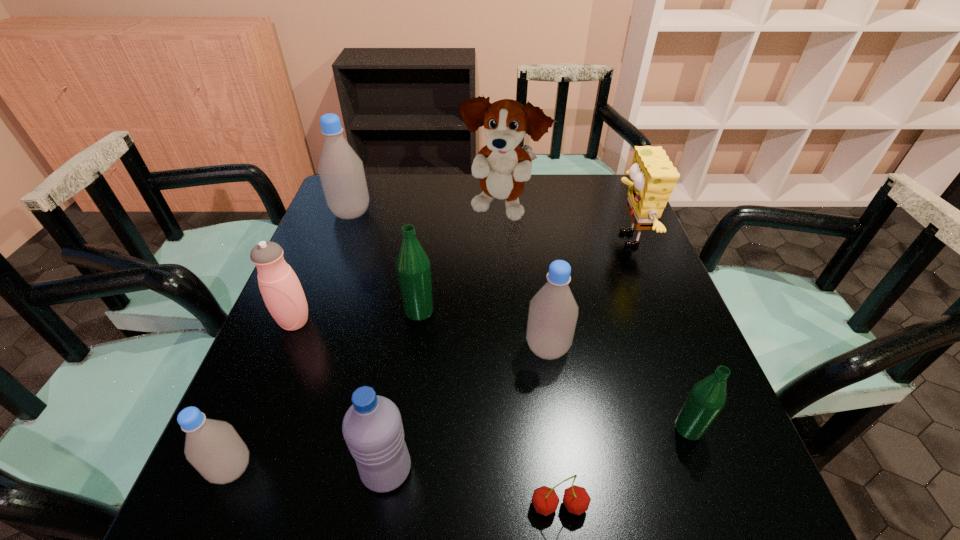
You are a GUI agent. You are given a task and a screenshot of the screen. Output one action in this format:
    pyautogui.click(x=<x>, y=<y>)
    Task: Click on the free spot that satisfies the following two spatial constraints: 1. on the face of the puppy; 2. on the right side of the right green bottle
    Image resolution: width=960 pixels, height=540 pixels.
    Given the screenshot: What is the action you would take?
    pyautogui.click(x=514, y=428)

You are a GUI agent. You are given a task and a screenshot of the screen. Output one action in this format:
    pyautogui.click(x=<x>, y=<y>)
    Task: Click on the vacant space that satisfies the following two spatial constraints: 1. on the face of the rightmost gray bottle; 2. on the left side of the puppy
    
    Given the screenshot: What is the action you would take?
    pyautogui.click(x=509, y=348)